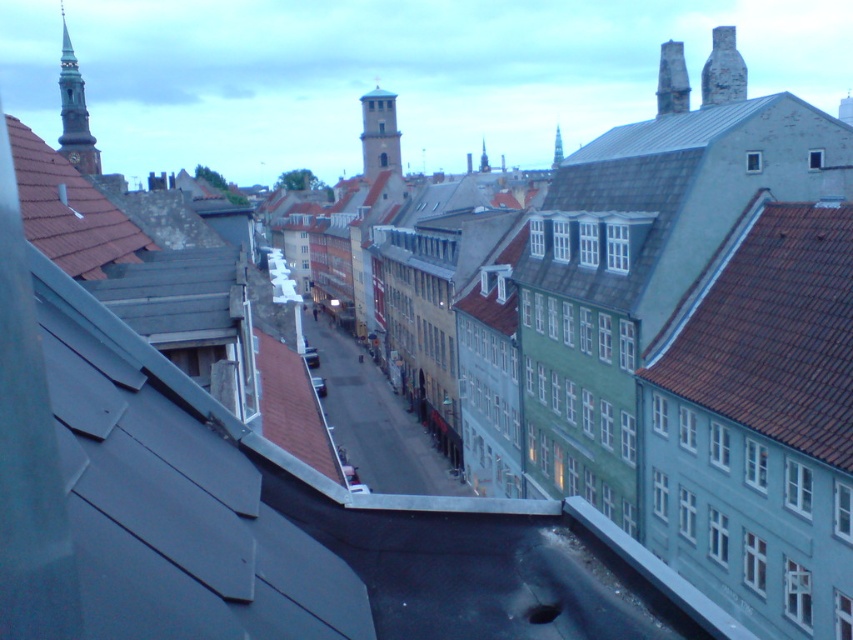
Question: Which object is positioned closest to the smooth stone spire at upper left?

Choices:
 (A) smooth stone tower at center
 (B) brown tiled roof at center-right
 (C) red tile roof at upper left

Answer: (B)

Question: Does red tile roof at upper left appear under smooth stone tower at center?

Choices:
 (A) no
 (B) yes

Answer: (B)

Question: Can you confirm if smooth stone spire at upper left is positioned above smooth stone tower at center?

Choices:
 (A) no
 (B) yes

Answer: (B)

Question: Among these points, which one is farthest from the camera?

Choices:
 (A) (65, 177)
 (B) (73, 58)
 (C) (381, 147)

Answer: (C)

Question: Which object is closer to the camera taking this photo?

Choices:
 (A) red tile roof at upper left
 (B) smooth stone tower at center

Answer: (A)

Question: Observing the image, what is the correct spatial positioning of red tile roof at upper left in reference to smooth stone tower at center?

Choices:
 (A) below
 (B) above

Answer: (A)